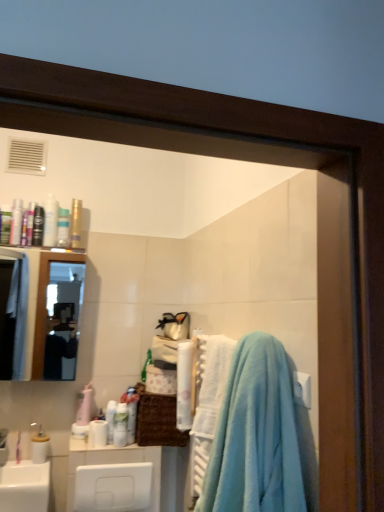
Question: Can you see shiny black tube at upper left, which ranks as the 6th toiletry in right-to-left order, touching white glossy bottle at center, which ranks as the 1th toiletry in right-to-left order?

Choices:
 (A) yes
 (B) no

Answer: (B)

Question: Considering the relative sizes of shiny black tube at upper left, which ranks as the 6th toiletry in right-to-left order, and white glossy bottle at center, which ranks as the 1th toiletry in right-to-left order, in the image provided, is shiny black tube at upper left, which ranks as the 6th toiletry in right-to-left order, taller than white glossy bottle at center, which ranks as the 1th toiletry in right-to-left order,?

Choices:
 (A) yes
 (B) no

Answer: (B)

Question: Is shiny black tube at upper left, which ranks as the 6th toiletry in right-to-left order, aimed at white glossy bottle at center, which ranks as the 1th toiletry in right-to-left order?

Choices:
 (A) no
 (B) yes

Answer: (A)

Question: Is shiny black tube at upper left, which is counted as the fourth toiletry, starting from the left, located outside white glossy bottle at center, positioned as the ninth toiletry in left-to-right order?

Choices:
 (A) yes
 (B) no

Answer: (A)

Question: Does shiny black tube at upper left, which ranks as the 6th toiletry in right-to-left order, have a greater width compared to white glossy bottle at center, positioned as the ninth toiletry in left-to-right order?

Choices:
 (A) yes
 (B) no

Answer: (B)

Question: From the image's perspective, is white plastic bottle at lower center, placed as the 8th toiletry when sorted from left to right, located above or below matte white spray can at upper left, the 4th toiletry in the right-to-left sequence?

Choices:
 (A) above
 (B) below

Answer: (B)

Question: Considering the positions of white plastic bottle at lower center, placed as the 8th toiletry when sorted from left to right, and matte white spray can at upper left, marked as the 6th toiletry in a left-to-right arrangement, in the image, is white plastic bottle at lower center, placed as the 8th toiletry when sorted from left to right, wider or thinner than matte white spray can at upper left, marked as the 6th toiletry in a left-to-right arrangement,?

Choices:
 (A) wide
 (B) thin

Answer: (A)

Question: Is white plastic bottle at lower center, placed as the 8th toiletry when sorted from left to right, spatially inside matte white spray can at upper left, marked as the 6th toiletry in a left-to-right arrangement, or outside of it?

Choices:
 (A) outside
 (B) inside

Answer: (A)

Question: Relative to matte white spray can at upper left, marked as the 6th toiletry in a left-to-right arrangement, is white plastic bottle at lower center, placed as the 8th toiletry when sorted from left to right, in front or behind?

Choices:
 (A) front
 (B) behind

Answer: (A)

Question: Relative to white plastic bottle at lower center, arranged as the 2th toiletry when viewed from the right, is clear glass mirror at upper left in front or behind?

Choices:
 (A) behind
 (B) front

Answer: (B)

Question: In terms of height, does clear glass mirror at upper left look taller or shorter compared to white plastic bottle at lower center, placed as the 8th toiletry when sorted from left to right?

Choices:
 (A) short
 (B) tall

Answer: (B)

Question: Is clear glass mirror at upper left wider or thinner than white plastic bottle at lower center, placed as the 8th toiletry when sorted from left to right?

Choices:
 (A) thin
 (B) wide

Answer: (B)

Question: In terms of size, does clear glass mirror at upper left appear bigger or smaller than white plastic bottle at lower center, arranged as the 2th toiletry when viewed from the right?

Choices:
 (A) small
 (B) big

Answer: (B)

Question: Does point (81, 222) appear closer or farther from the camera than point (59, 237)?

Choices:
 (A) closer
 (B) farther

Answer: (B)

Question: Looking at the image, does gold metallic spray can at upper left, which is counted as the third toiletry, starting from the right, seem bigger or smaller compared to matte white spray can at upper left, marked as the 6th toiletry in a left-to-right arrangement?

Choices:
 (A) big
 (B) small

Answer: (A)